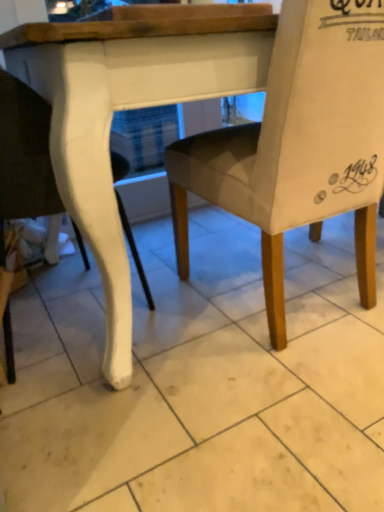
This screenshot has height=512, width=384. I want to click on vacant area on top of white glossy tile at center (from a real-world perspective), so click(223, 317).